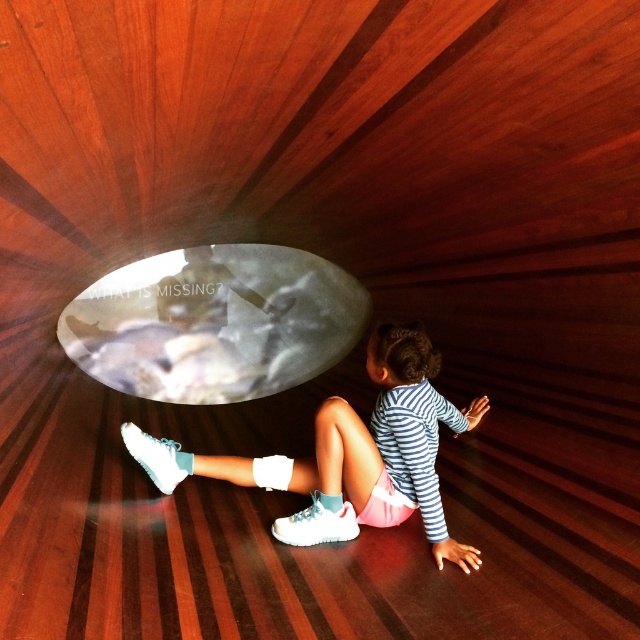
Question: Is the position of translucent glass bubble at center more distant than that of white matte sneakers at lower center?

Choices:
 (A) yes
 (B) no

Answer: (A)

Question: Observing the image, what is the correct spatial positioning of translucent glass bubble at center in reference to white matte sneakers at lower center?

Choices:
 (A) right
 (B) left

Answer: (B)

Question: Observing the image, what is the correct spatial positioning of translucent glass bubble at center in reference to white matte sneakers at lower center?

Choices:
 (A) right
 (B) left

Answer: (B)

Question: Which object appears farthest from the camera in this image?

Choices:
 (A) translucent glass bubble at center
 (B) white matte sneakers at lower center

Answer: (A)

Question: Among these objects, which one is nearest to the camera?

Choices:
 (A) translucent glass bubble at center
 (B) white matte sneakers at lower center

Answer: (B)